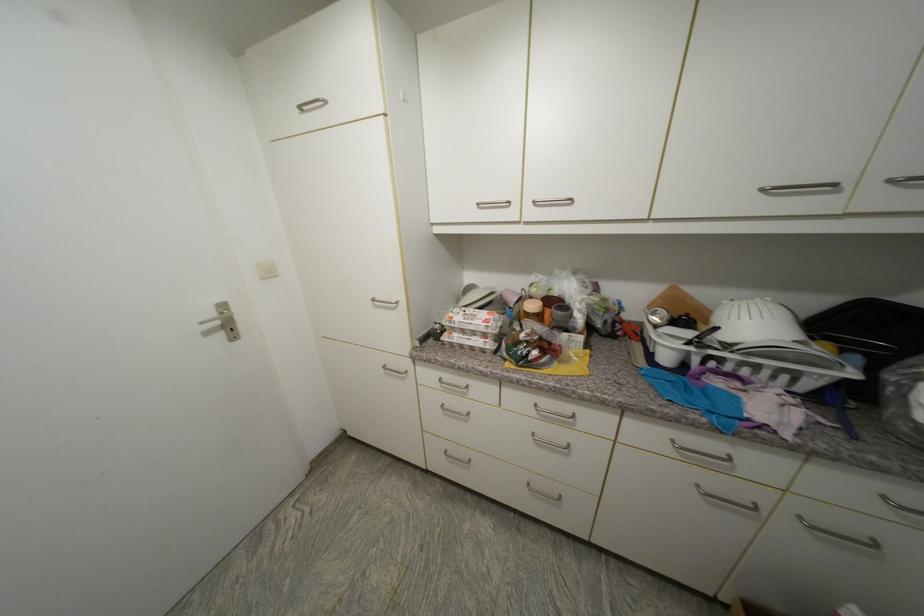
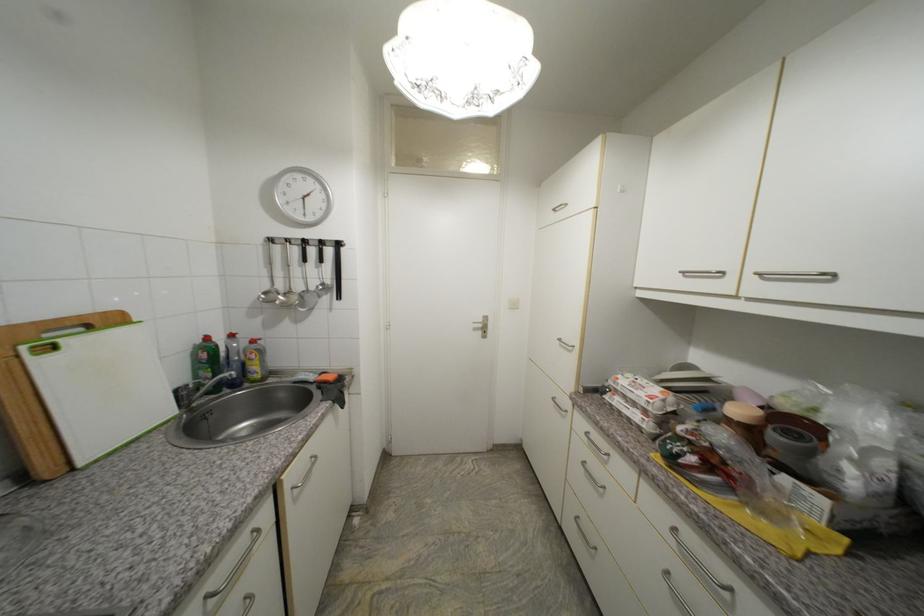
Where in the second image is the point corresponding to the point at 460,342 from the first image?

(619, 405)